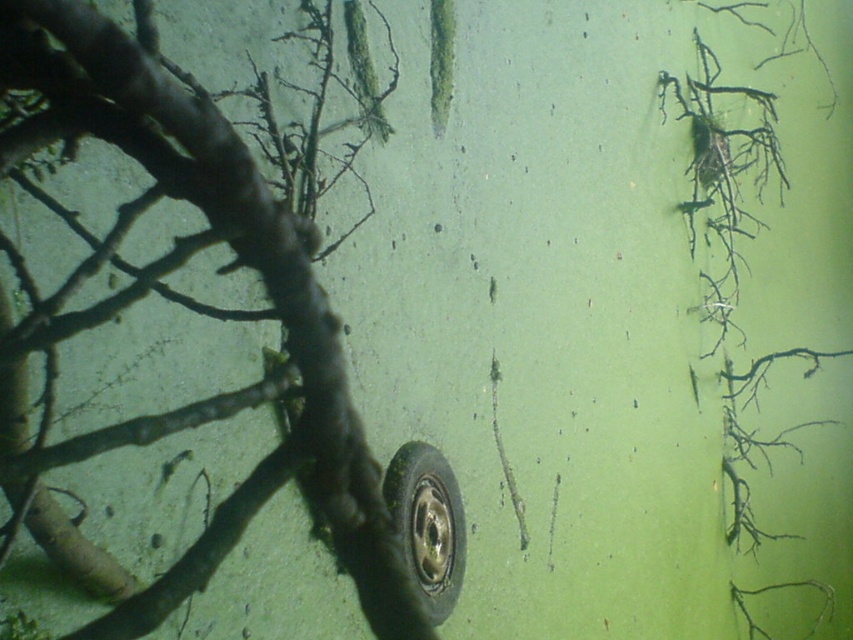
Question: Is brown rough branch at center smaller than black rubber tire at center?

Choices:
 (A) no
 (B) yes

Answer: (A)

Question: Which object appears farthest from the camera in this image?

Choices:
 (A) brown rough branch at center
 (B) black rubber tire at center

Answer: (B)

Question: Is brown rough branch at center above black rubber tire at center?

Choices:
 (A) no
 (B) yes

Answer: (B)

Question: Which of the following is the farthest from the observer?

Choices:
 (A) black rubber tire at center
 (B) brown rough branch at center

Answer: (A)

Question: Can you confirm if brown rough branch at center is positioned above black rubber tire at center?

Choices:
 (A) no
 (B) yes

Answer: (B)

Question: Which point appears farthest from the camera in this image?

Choices:
 (A) (375, 476)
 (B) (444, 618)

Answer: (B)